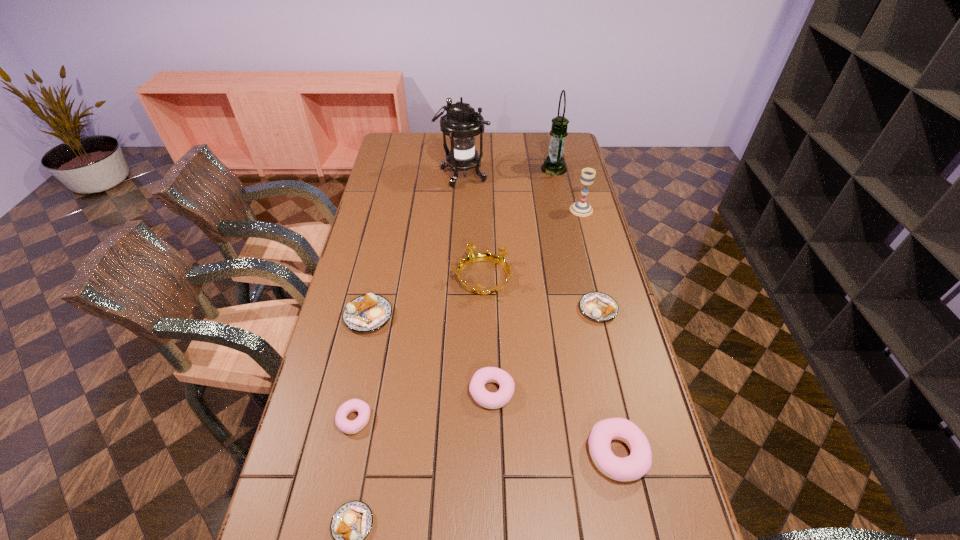
Find the location of `the left lantern`. the left lantern is located at coordinates coord(461,123).

The width and height of the screenshot is (960, 540). I want to click on green lantern, so click(554, 164).

You are a GUI agent. You are given a task and a screenshot of the screen. Output one action in this format:
    pyautogui.click(x=<x>, y=<y>)
    Task: Click on the eighth shortest object
    This screenshot has height=540, width=960.
    Given the screenshot: What is the action you would take?
    pyautogui.click(x=581, y=208)

Identify the location of chalice. The image size is (960, 540). (581, 208).

I want to click on crown, so click(x=473, y=257).

Locate an element on the screen. the fourth tallest object is located at coordinates (473, 257).

You are a GUI agent. You are given a task and a screenshot of the screen. Output one action in this format:
    pyautogui.click(x=<x>, y=<y>)
    Task: Click on the biggest pink pastry
    The width and height of the screenshot is (960, 540).
    Given the screenshot: What is the action you would take?
    pyautogui.click(x=638, y=463)

The width and height of the screenshot is (960, 540). What are the coordinates of `the biggest brown pastry` in the screenshot? It's located at (366, 313).

This screenshot has width=960, height=540. Find the location of `the second pink pastry from right to left`. the second pink pastry from right to left is located at coordinates (486, 399).

You are a GUI agent. You are given a task and a screenshot of the screen. Output one action in this format:
    pyautogui.click(x=<x>, y=<y>)
    Task: Click on the second smallest pink pastry
    The width and height of the screenshot is (960, 540).
    Given the screenshot: What is the action you would take?
    pyautogui.click(x=486, y=399)